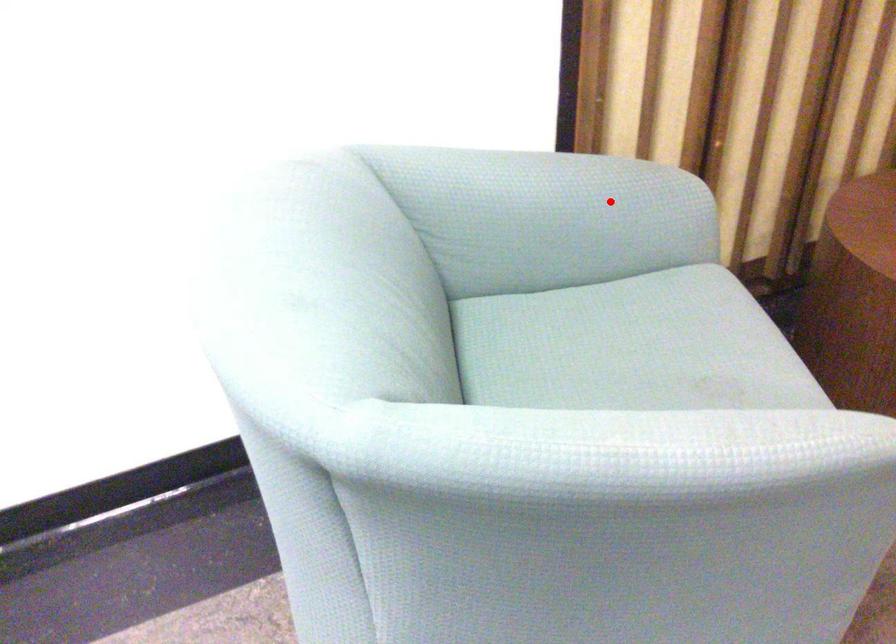
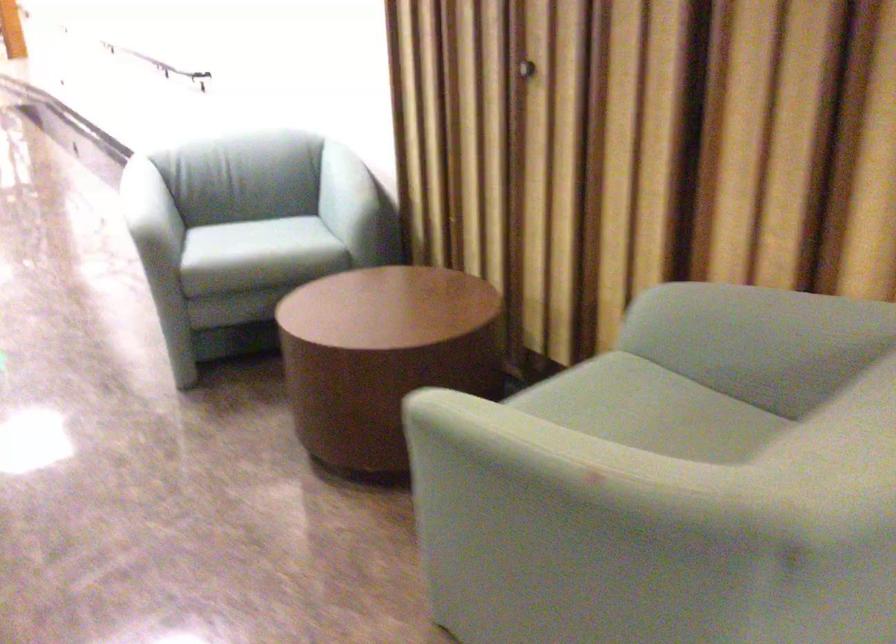
In the second image, find the point that corresponds to the highlighted location in the first image.

(346, 191)